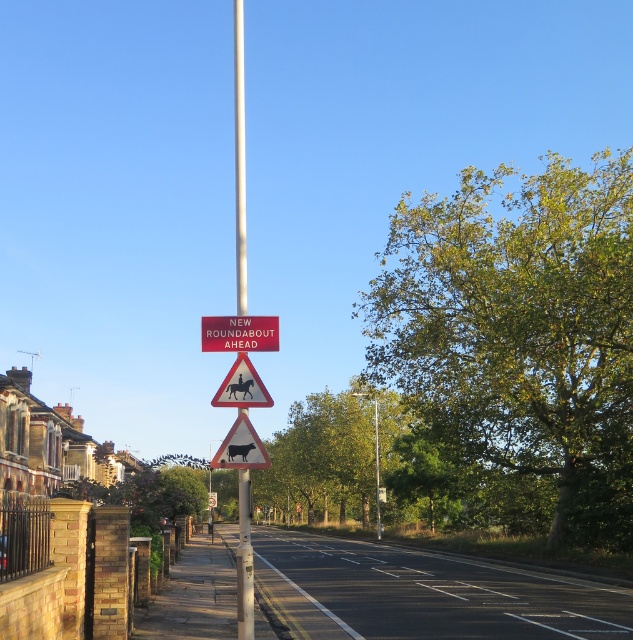
Question: Which point is farther to the camera?

Choices:
 (A) (272, 348)
 (B) (258, 387)
 (C) (385, 458)
 (D) (613, 445)

Answer: (C)

Question: Among these objects, which one is farthest from the camera?

Choices:
 (A) white plastic triangular sign with horse symbol at center
 (B) silver metallic pole at center
 (C) red plastic sign at center

Answer: (C)

Question: Can you confirm if green leafy tree at center is positioned to the right of red plastic sign at center?

Choices:
 (A) no
 (B) yes

Answer: (B)

Question: Does metallic triangular sign with cow at center have a larger size compared to white plastic triangular sign with horse symbol at center?

Choices:
 (A) yes
 (B) no

Answer: (A)

Question: Observing the image, what is the correct spatial positioning of metallic triangular sign with cow at center in reference to white plastic triangular sign with horse symbol at center?

Choices:
 (A) above
 (B) below

Answer: (B)

Question: Estimate the real-world distances between objects in this image. Which object is closer to the white plastic triangular sign with horse symbol at center?

Choices:
 (A) silver metallic pole at center
 (B) green leafy tree at right
 (C) green leafy tree at center

Answer: (B)